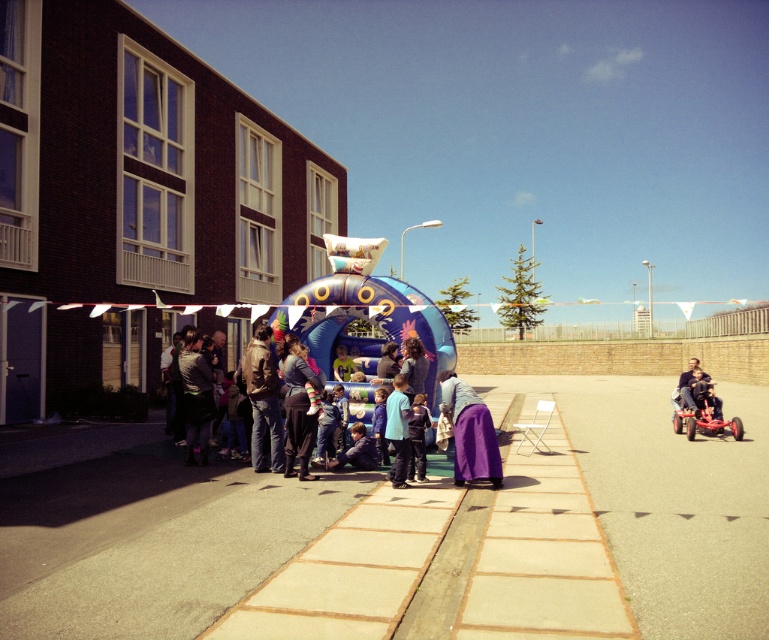
Is point (220, 474) positioned behind point (674, 410)?

No, (220, 474) is in front of (674, 410).

Can you confirm if smooth concrete pavement at center is positioned below red plastic baby carriage at lower right?

Yes, smooth concrete pavement at center is below red plastic baby carriage at lower right.

In order to click on smooth concrete pavement at center in this screenshot , I will do `click(151, 544)`.

Which of these two, purple fabric at center or red plastic baby carriage at lower right, stands shorter?

With less height is red plastic baby carriage at lower right.

Between purple fabric at center and red plastic baby carriage at lower right, which one has more height?

purple fabric at center

Does point (242, 365) come in front of point (697, 380)?

Yes, point (242, 365) is in front of point (697, 380).

Find the location of `purple fabric at center`. purple fabric at center is located at coordinates (283, 384).

Who is positioned more to the left, smooth concrete pavement at center or purple fabric at center?

purple fabric at center

Is smooth concrete pavement at center to the left of purple fabric at center from the viewer's perspective?

In fact, smooth concrete pavement at center is to the right of purple fabric at center.

Locate an element on the screen. The width and height of the screenshot is (769, 640). smooth concrete pavement at center is located at coordinates (151, 544).

The width and height of the screenshot is (769, 640). In order to click on smooth concrete pavement at center in this screenshot , I will do `click(151, 544)`.